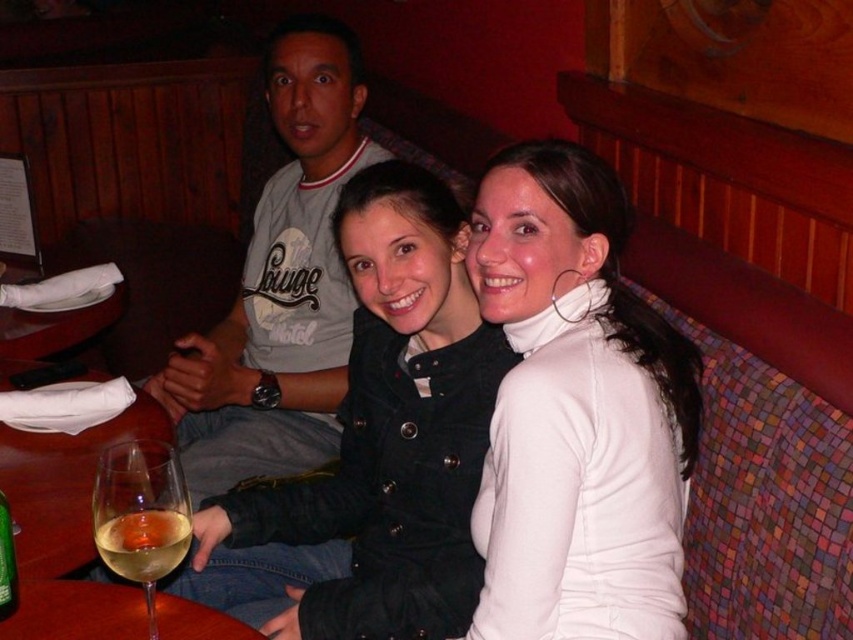
Can you confirm if clear glass wine glass at lower left is positioned to the left of translucent glass wine at lower left?

Incorrect, clear glass wine glass at lower left is not on the left side of translucent glass wine at lower left.

Between clear glass wine glass at lower left and translucent glass wine at lower left, which one is positioned higher?

clear glass wine glass at lower left

Is point (106, 492) less distant than point (3, 528)?

That is True.

Identify the location of clear glass wine glass at lower left. (141, 515).

Between black velvet jacket at center and translucent glass wine at lower left, which one has more height?

With more height is black velvet jacket at center.

Is black velvet jacket at center taller than translucent glass wine at lower left?

Yes, black velvet jacket at center is taller than translucent glass wine at lower left.

Image resolution: width=853 pixels, height=640 pixels. I want to click on black velvet jacket at center, so click(378, 444).

Is white matte turtleneck at center wider than white translucent glass at lower left?

Yes.

Who is more forward, (547, 474) or (178, 512)?

Point (178, 512)

The width and height of the screenshot is (853, 640). What are the coordinates of `white matte turtleneck at center` in the screenshot? It's located at (576, 412).